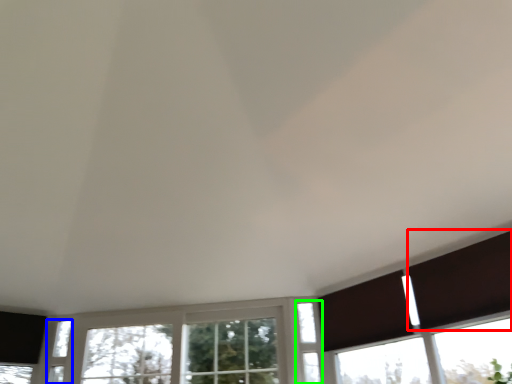
Question: Estimate the real-world distances between objects in this image. Which object is closer to shutter (highlighted by a red box), window (highlighted by a blue box) or window (highlighted by a green box)?

Choices:
 (A) window
 (B) window

Answer: (B)